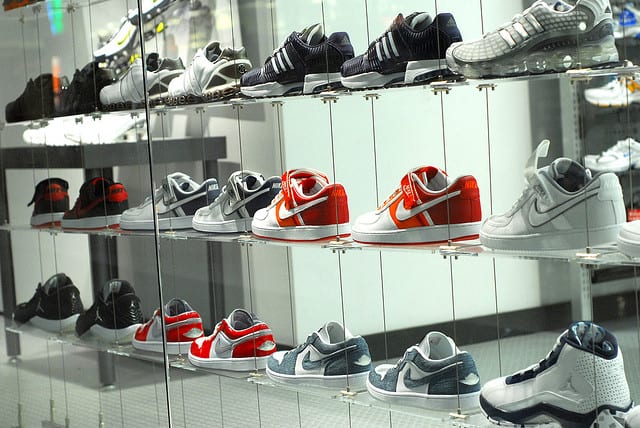
Find the location of `shoes on the top shelf`. shoes on the top shelf is located at coordinates (28, 101), (129, 91), (186, 86), (285, 68), (394, 71), (484, 67).